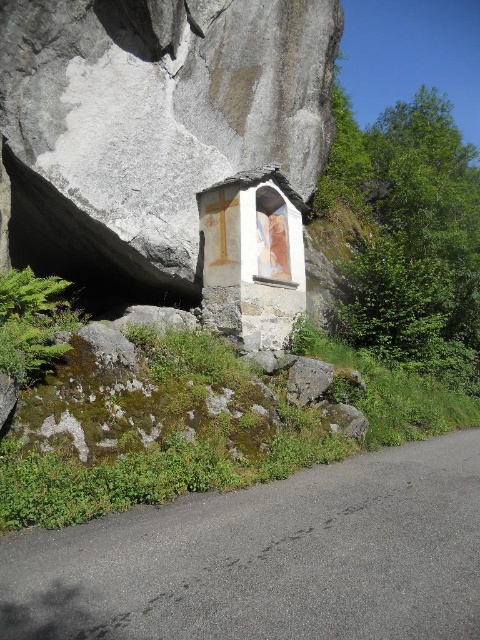
Question: Does asphalt road at lower center appear on the right side of white painted stone chapel at center?

Choices:
 (A) no
 (B) yes

Answer: (B)

Question: Considering the real-world distances, which object is farthest from the smooth gray rock at center?

Choices:
 (A) white painted stone chapel at center
 (B) asphalt road at lower center

Answer: (B)

Question: Where is smooth gray rock at center located in relation to white painted stone chapel at center in the image?

Choices:
 (A) below
 (B) above

Answer: (B)

Question: Considering the real-world distances, which object is closest to the white painted stone chapel at center?

Choices:
 (A) asphalt road at lower center
 (B) smooth gray rock at center

Answer: (B)

Question: Is smooth gray rock at center positioned in front of white painted stone chapel at center?

Choices:
 (A) yes
 (B) no

Answer: (A)

Question: Which point is closer to the camera?

Choices:
 (A) asphalt road at lower center
 (B) white painted stone chapel at center

Answer: (A)